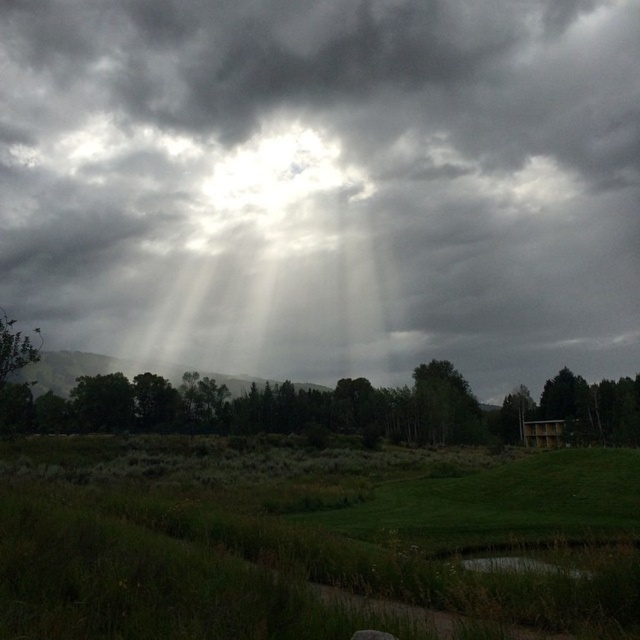
You are standing in the grassy field and want to walk towards the green matte tree at lower right. Which direction should you head relative to the green matte tree at center?

You should head to the right of the green matte tree at center to reach the green matte tree at lower right, since the green matte tree at center is to the left of the green matte tree at lower right.

You are an observer standing in the field and looking at the green grass at center and the green matte tree at center. Which object is positioned higher in the scene?

The green grass at center is positioned higher than the green matte tree at center in the scene.

You are an observer standing in the middle of the green grass at center. Looking up, you notice the dark gray cloud at upper center. Considering their sizes, which object appears bigger to you?

The dark gray cloud at upper center appears bigger than the green grass at center because it has a larger size compared to the green grass at center.